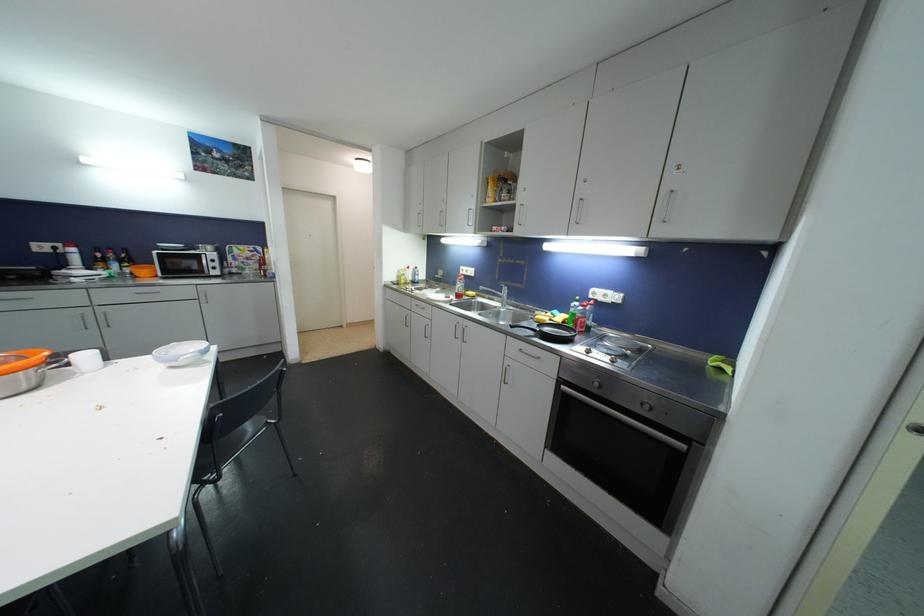
What do you see at coordinates (86, 361) in the screenshot? The width and height of the screenshot is (924, 616). I see `the white cup` at bounding box center [86, 361].